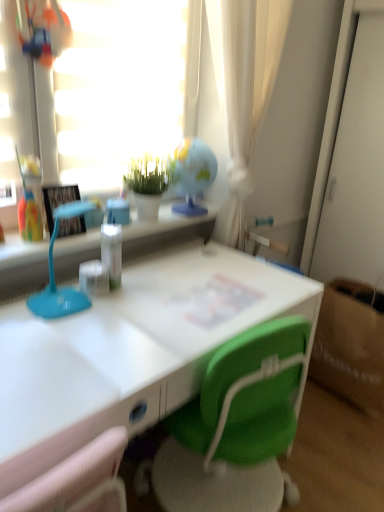
Where is `free space in front of clear plastic bottle at center`? free space in front of clear plastic bottle at center is located at coordinates (99, 311).